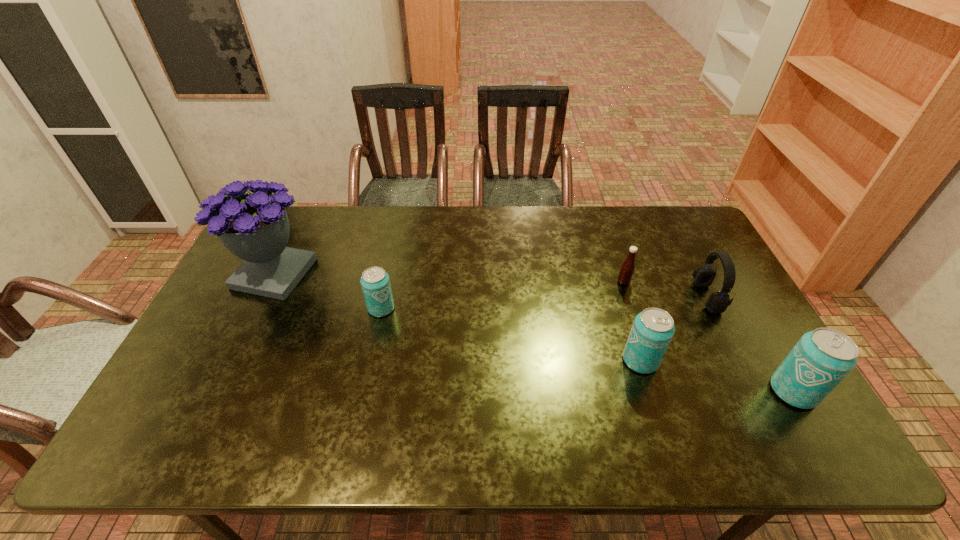
Choose which beer can is the second nearest neighbor to the second beer can from left to right. Please provide its 2D coordinates. Your answer should be formatted as a tuple, i.e. [(x, y)], where the tuple contains the x and y coordinates of a point satisfying the conditions above.

[(375, 282)]

Locate an element on the screen. This screenshot has width=960, height=540. beer can identified as the closest to the leftmost beer can is located at coordinates (653, 329).

You are a GUI agent. You are given a task and a screenshot of the screen. Output one action in this format:
    pyautogui.click(x=<x>, y=<y>)
    Task: Click on the free space that satisfies the following two spatial constraints: 1. on the front side of the shortest beer can; 2. on the right side of the rightmost beer can
    Image resolution: width=960 pixels, height=540 pixels.
    Given the screenshot: What is the action you would take?
    pyautogui.click(x=363, y=391)

This screenshot has width=960, height=540. Identify the location of free space that satisfies the following two spatial constraints: 1. on the back side of the Tabasco sauce; 2. on the left side of the second beer can from right to left. (615, 282).

At what (x,y) coordinates should I click in order to perform the action: click on free region that satisfies the following two spatial constraints: 1. on the headband of the rightmost beer can; 2. on the right side of the second object from right to left. Please return your answer as a coordinate pair (x, y). Looking at the image, I should click on 755,391.

The width and height of the screenshot is (960, 540). Identify the location of free location that satisfies the following two spatial constraints: 1. on the front side of the bouquet; 2. on the left side of the farthest beer can. (257, 308).